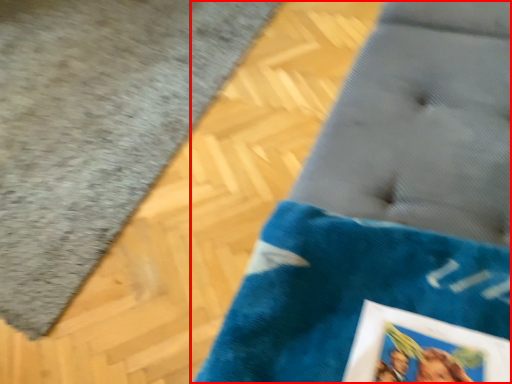
Question: From the image's perspective, what is the correct spatial relationship of furniture (annotated by the red box) in relation to bath mat?

Choices:
 (A) above
 (B) below

Answer: (B)